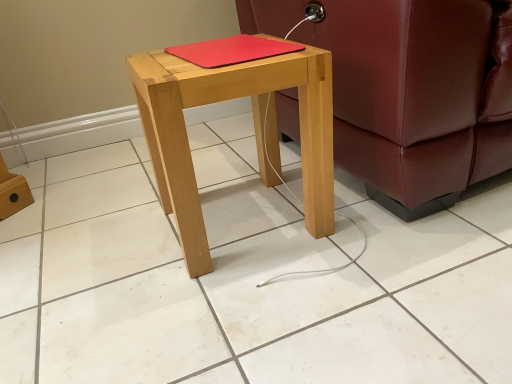
Identify the location of unoccupied space behind natural wood stool at center. This screenshot has height=384, width=512. (227, 168).